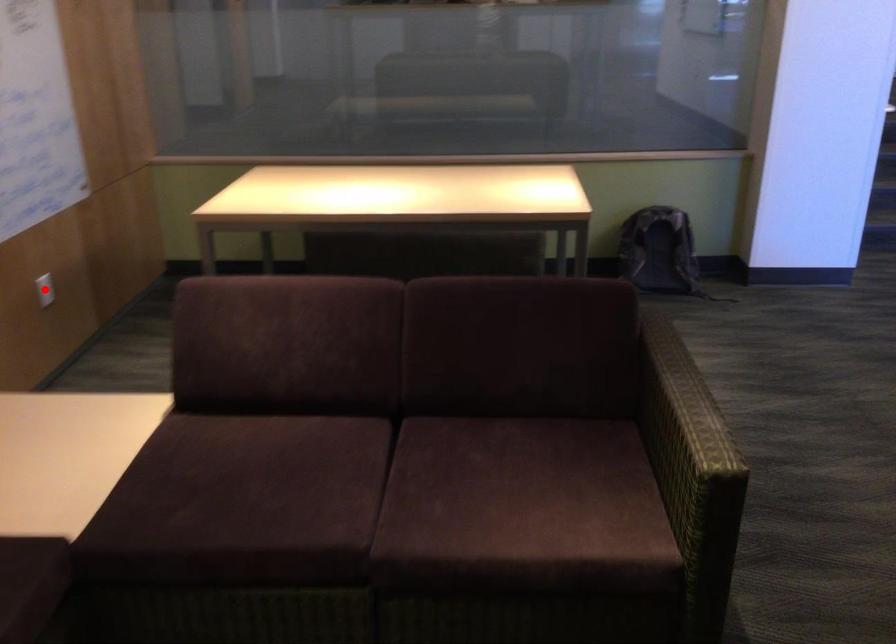
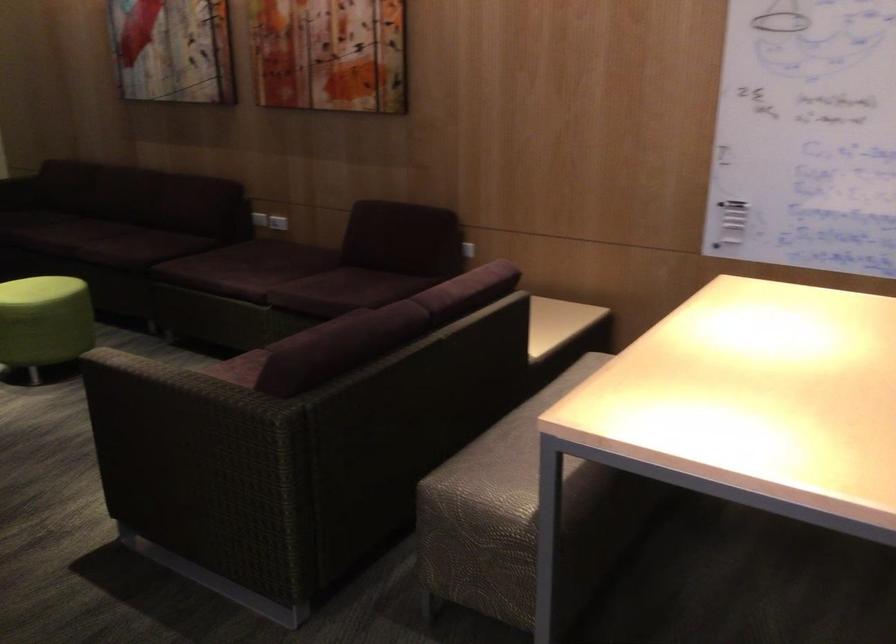
Question: I am providing you with two images of the same scene from different viewpoints. A red point is marked on the first image. Can you still see the location of the red point in image 2?

Choices:
 (A) Yes
 (B) No

Answer: (B)